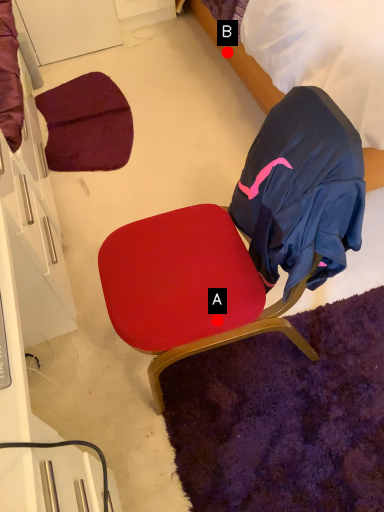
Question: Two points are circled on the image, labeled by A and B beside each circle. Which of the following is the closest to the observer?

Choices:
 (A) A is closer
 (B) B is closer

Answer: (A)